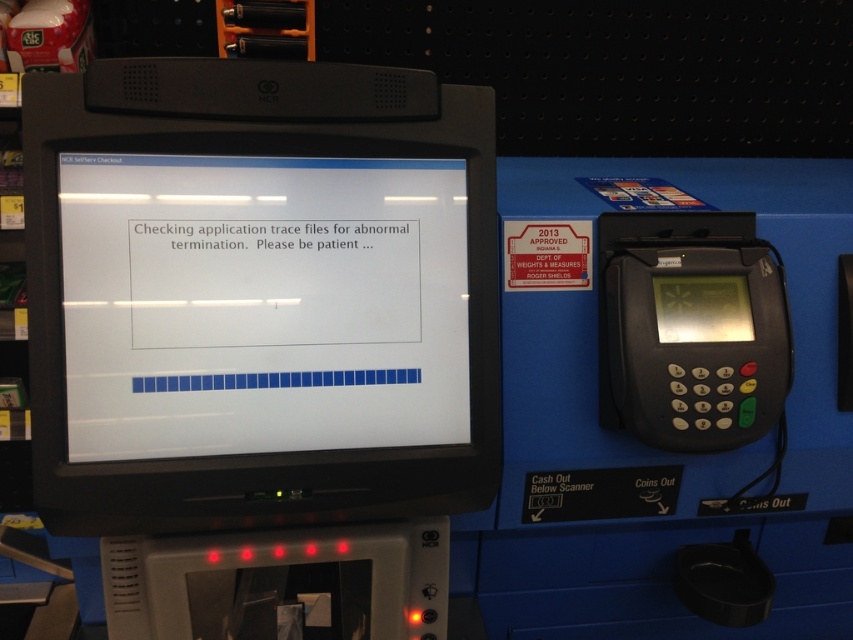
You are a customer at a store trying to complete your purchase. You see the black glossy monitor at center and the black plastic keypad at right. Which device should you interact with first to continue your transaction?

The black glossy monitor at center is positioned over the black plastic keypad at right, so you should interact with the black glossy monitor at center first since it is above the keypad and likely guiding the transaction steps.

You are a customer at the store and want to check your balance on the payment terminal. You notice the black glossy monitor at center and the black plastic keypad at right. Which object should you interact with to access the payment functions?

You should interact with the black plastic keypad at right to access the payment functions because the black glossy monitor at center is displaying a message about checking application trace files and is closer to the viewer, but the payment functions are typically handled by the keypad terminal.

You are standing in front of the self service checkout terminal. There are two points marked on the terminal. One is at coordinate point (32, 376) and the other is at point (709, 316). Which point is closer to you?

Point (32, 376) is closer to the camera than point (709, 316).